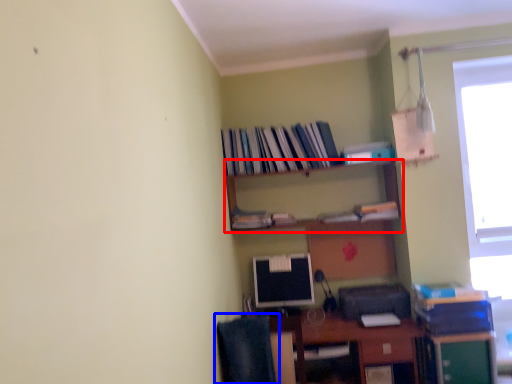
Question: Which of the following is the closest to the observer, shelf (highlighted by a red box) or computer chair (highlighted by a blue box)?

Choices:
 (A) shelf
 (B) computer chair

Answer: (B)